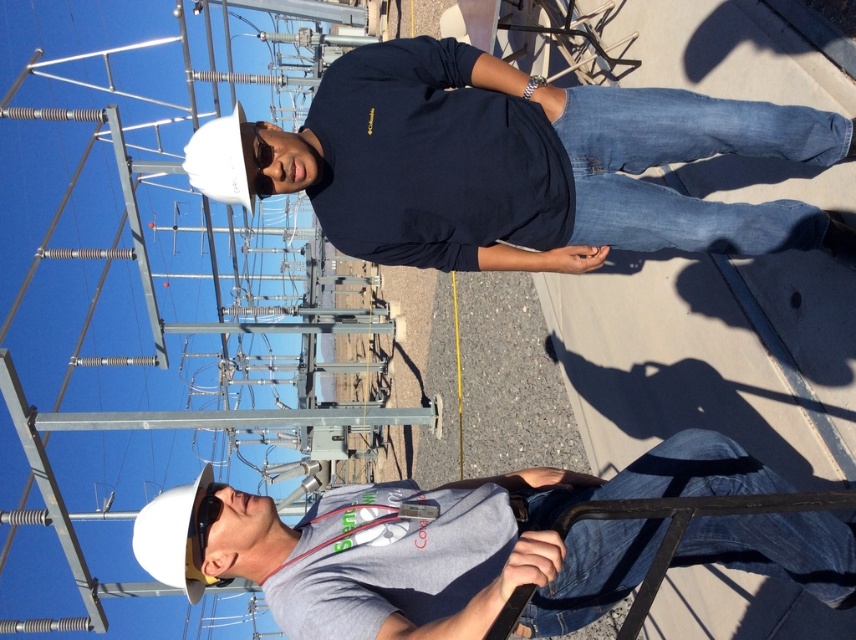
Who is more distant from viewer, [479,193] or [739,529]?

The point [479,193] is behind.

Does dark blue shirt at center lie behind gray matte shirt at center?

That is True.

Is point (730, 141) farther from viewer compared to point (693, 490)?

Yes, it is.

Where is `dark blue shirt at center`? Image resolution: width=856 pixels, height=640 pixels. dark blue shirt at center is located at coordinates (513, 163).